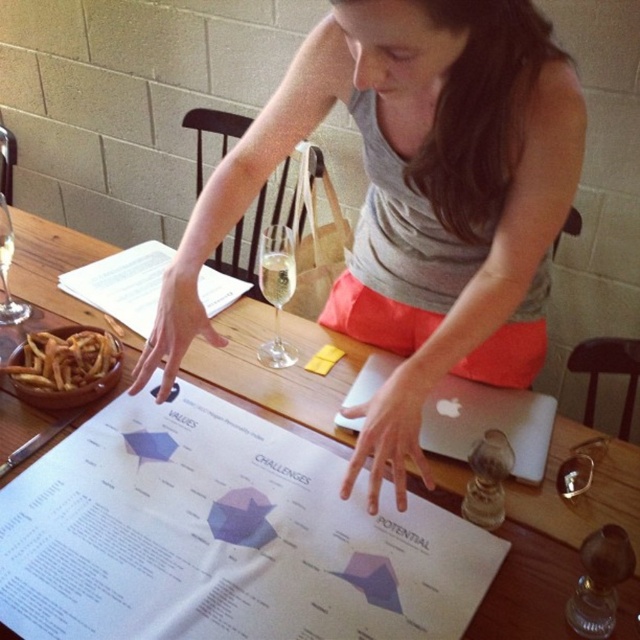
You are a guest at a dinner party and need to place your phone on the table without covering any of the important sections of the white paper document at center. Can you fit your phone on the remaining space of the white wood table at center?

The white paper document at center is thinner than the white wood table at center, so there is enough space on the white wood table at center to place your phone without covering the important sections of the white paper document at center.

You are planning to place a new object on the table. The object requires a space larger than the white paper document at center. Can you fit it on the white wood table at center?

The white paper document at center is shorter than the white wood table at center, so yes, the object can fit on the white wood table at center as it has more space available than the document.